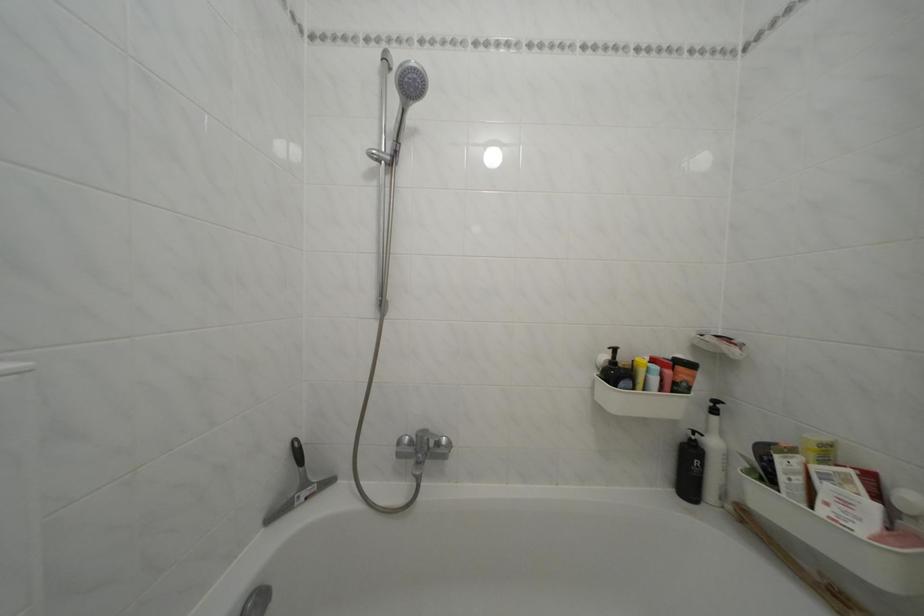
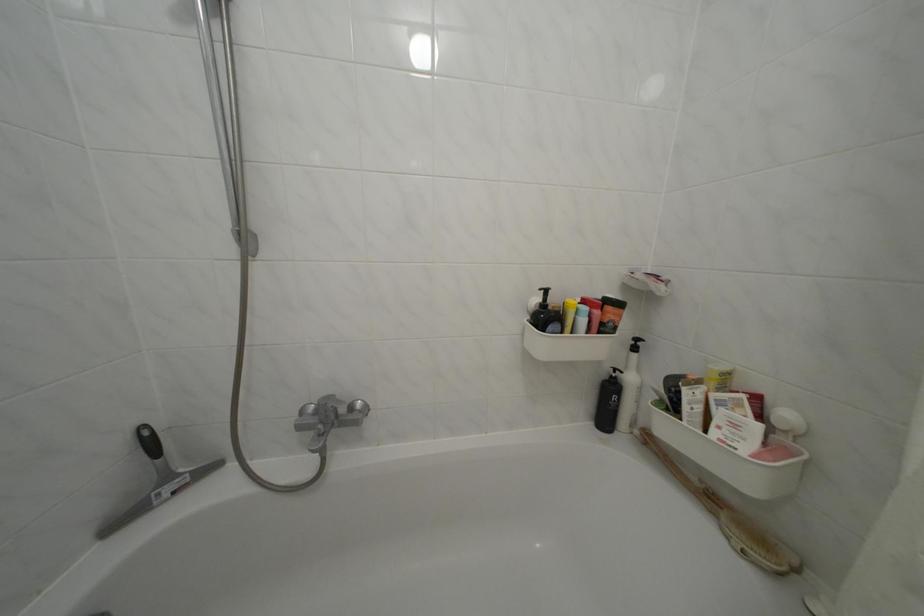
The point at (886, 546) is marked in the first image. Where is the corresponding point in the second image?

(766, 462)